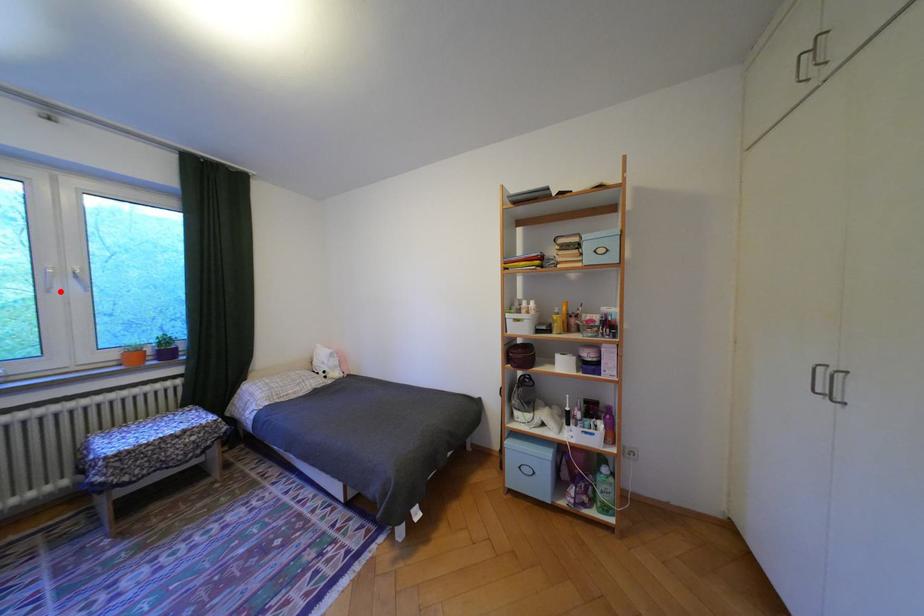
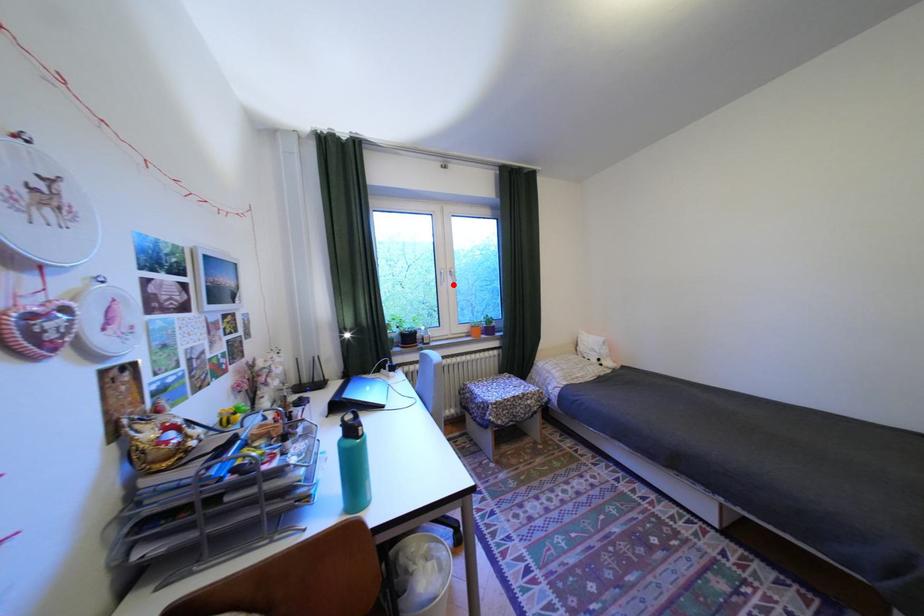
I am providing you with two images of the same scene from different viewpoints. A red point is marked on the first image and another point is marked on the second image. Is the marked point in image1 the same physical position as the marked point in image2?

Yes